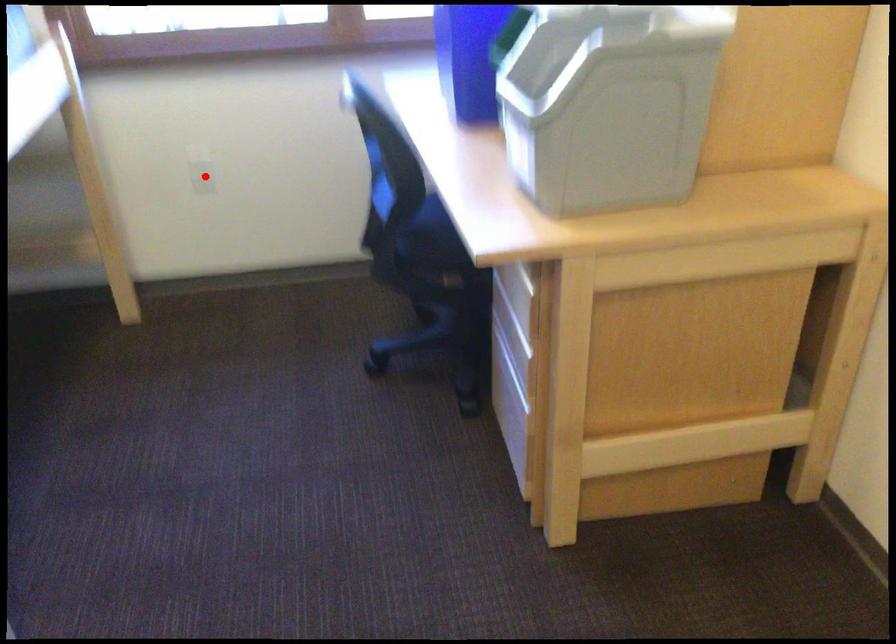
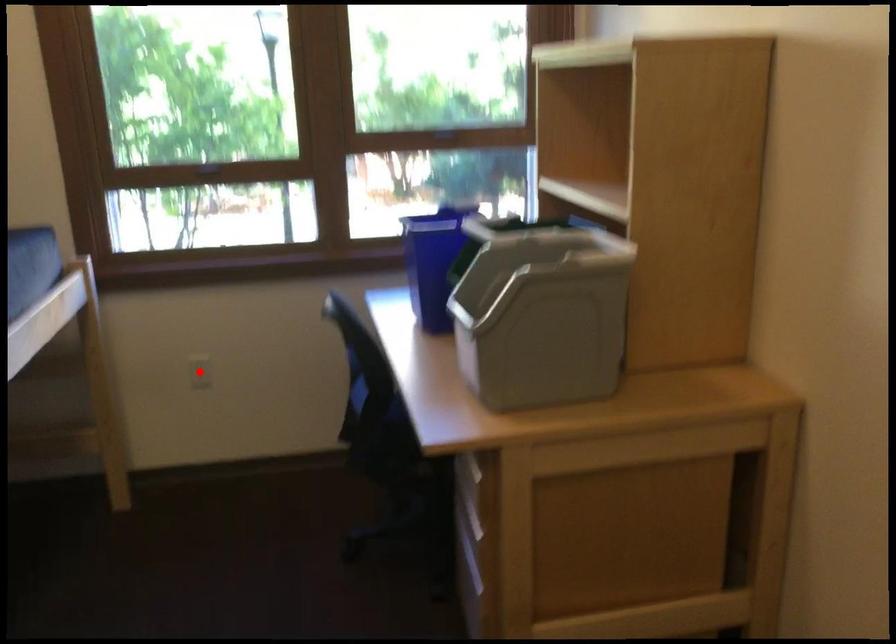
I am providing you with two images of the same scene from different viewpoints. A red point is marked on the first image and another point is marked on the second image. Is the red point in image1 aligned with the point shown in image2?

Yes